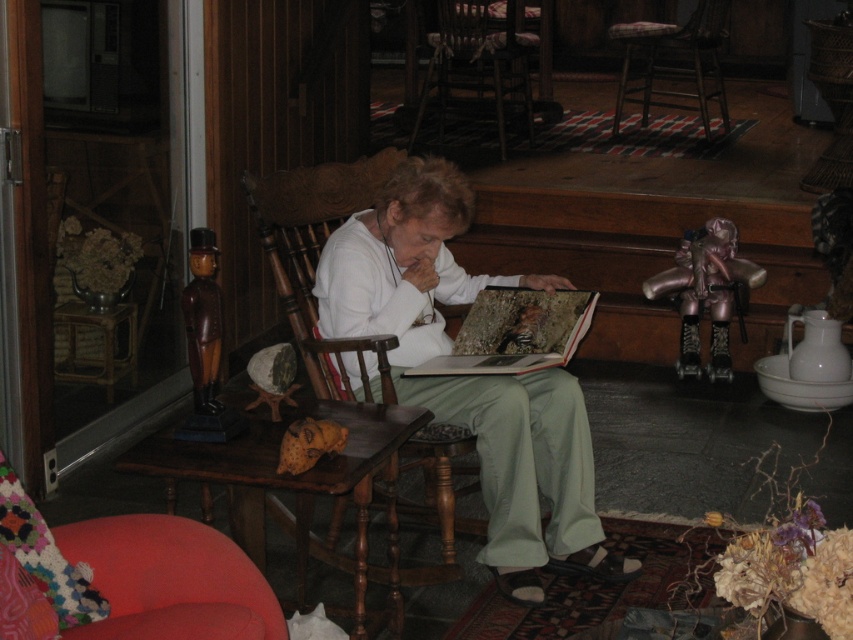
Question: Does white matte sweater at center have a larger size compared to plaid fabric cushioned stool at center?

Choices:
 (A) yes
 (B) no

Answer: (B)

Question: Is white matte sweater at center wider than plaid fabric cushioned stool at center?

Choices:
 (A) yes
 (B) no

Answer: (B)

Question: Which point appears farthest from the camera in this image?

Choices:
 (A) (379, 349)
 (B) (389, 355)

Answer: (B)

Question: Does wooden chair at center lie in front of metallic bronze doll at right?

Choices:
 (A) yes
 (B) no

Answer: (B)

Question: Which is farther from the plaid fabric cushioned stool at center?

Choices:
 (A) wooden at center
 (B) metallic bronze doll at right
 (C) wooden book at center

Answer: (C)

Question: Among these points, which one is nearest to the camera?

Choices:
 (A) (351, 272)
 (B) (692, 273)

Answer: (A)